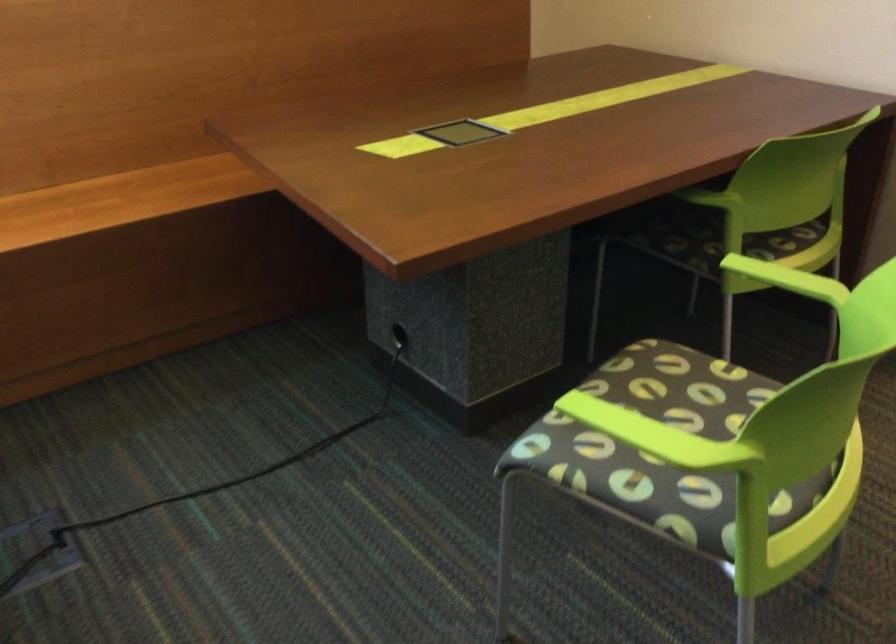
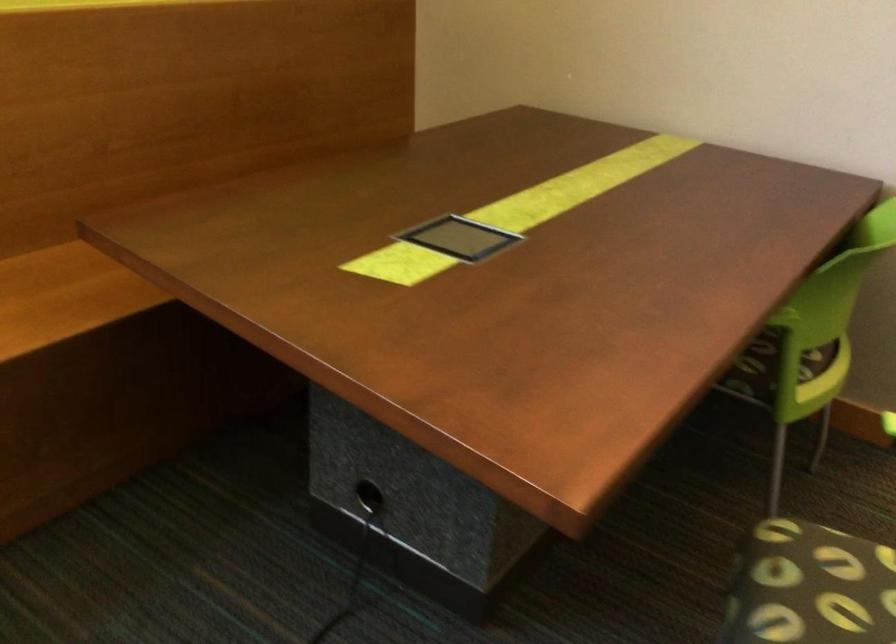
Question: The first image is from the beginning of the video and the second image is from the end. How did the camera likely rotate when shooting the video?

Choices:
 (A) Left
 (B) Right
 (C) Up
 (D) Down

Answer: (B)